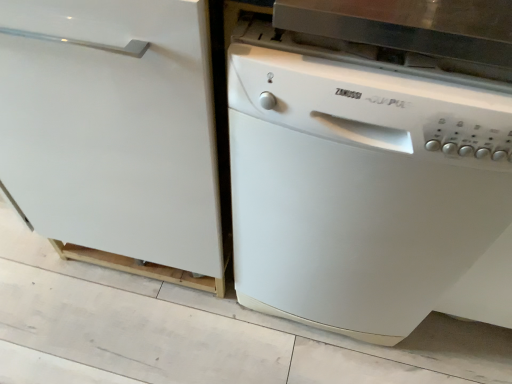
Question: Looking at their shapes, would you say white matte dishwasher at right is wider or thinner than white matte dishwasher at right?

Choices:
 (A) wide
 (B) thin

Answer: (A)

Question: Is white matte dishwasher at right in front of or behind white matte dishwasher at right in the image?

Choices:
 (A) front
 (B) behind

Answer: (B)

Question: From the image's perspective, is white matte dishwasher at right located above or below white matte dishwasher at right?

Choices:
 (A) above
 (B) below

Answer: (A)

Question: Is white matte dishwasher at right inside or outside of white matte dishwasher at right?

Choices:
 (A) outside
 (B) inside

Answer: (A)

Question: In terms of width, does white matte dishwasher at right look wider or thinner when compared to white matte dishwasher at right?

Choices:
 (A) wide
 (B) thin

Answer: (B)

Question: In the image, is white matte dishwasher at right on the left side or the right side of white matte dishwasher at right?

Choices:
 (A) right
 (B) left

Answer: (A)

Question: Considering the positions of white matte dishwasher at right and white matte dishwasher at right in the image, is white matte dishwasher at right bigger or smaller than white matte dishwasher at right?

Choices:
 (A) big
 (B) small

Answer: (B)